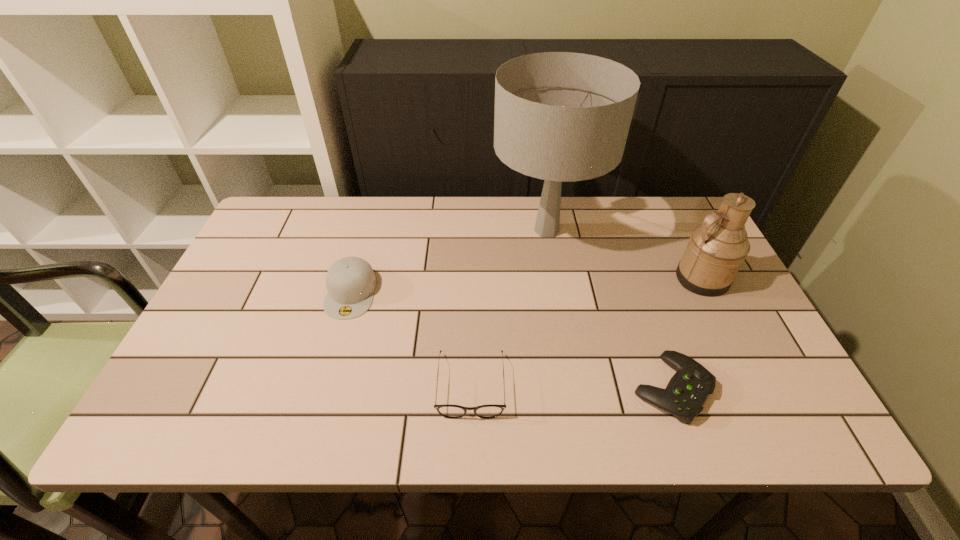
The width and height of the screenshot is (960, 540). I want to click on vacant space at the right edge of the desktop, so click(x=736, y=296).

The width and height of the screenshot is (960, 540). What are the coordinates of `free space at the near left corner of the desktop` in the screenshot? It's located at (178, 422).

In the image, there is a desktop. Identify the location of free space at the near right corner. (798, 417).

Identify the location of free space between the third shortest object and the pitcher. This screenshot has height=540, width=960. (526, 286).

Where is `vacant space that's between the second shortest object and the shortest object`? This screenshot has height=540, width=960. vacant space that's between the second shortest object and the shortest object is located at coordinates (571, 387).

Image resolution: width=960 pixels, height=540 pixels. Find the location of `empty space that is in between the tallest object and the control`. empty space that is in between the tallest object and the control is located at coordinates [x=610, y=309].

Where is `empty space between the third tallest object and the shortest object`? empty space between the third tallest object and the shortest object is located at coordinates (512, 340).

You are a GUI agent. You are given a task and a screenshot of the screen. Output one action in this format:
    pyautogui.click(x=<x>, y=<y>)
    Task: Click on the free spot between the pitcher and the lampshade
    The width and height of the screenshot is (960, 540).
    Given the screenshot: What is the action you would take?
    pyautogui.click(x=624, y=254)

Image resolution: width=960 pixels, height=540 pixels. Identify the location of vacant space that's between the third shortest object and the control. (x=512, y=340).

Where is `vacant space that's between the pitcher and the leftmost object`? The height and width of the screenshot is (540, 960). vacant space that's between the pitcher and the leftmost object is located at coordinates (526, 286).